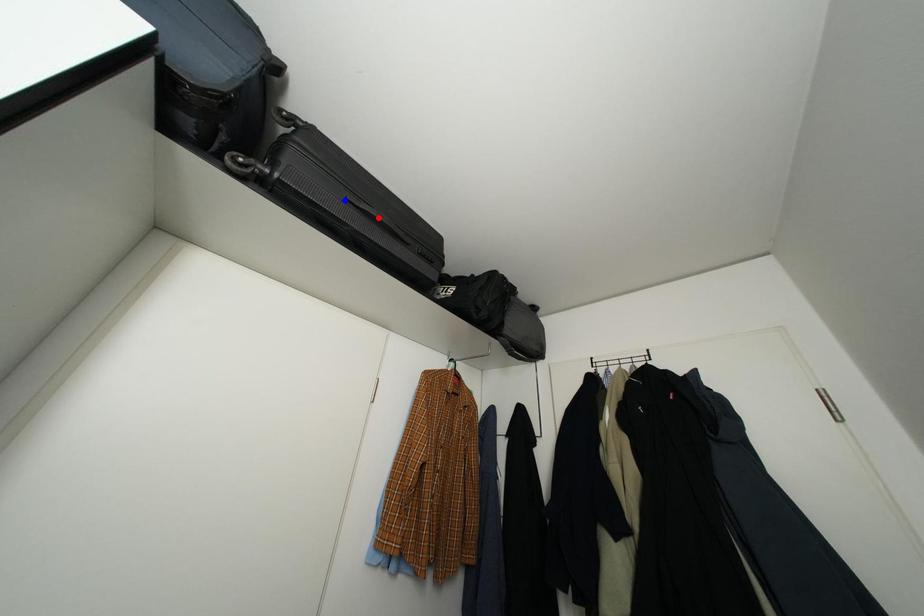
Question: In the image, two points are highlighted. Which point is nearer to the camera? Reply with the corresponding letter.

Choices:
 (A) blue point
 (B) red point

Answer: (A)